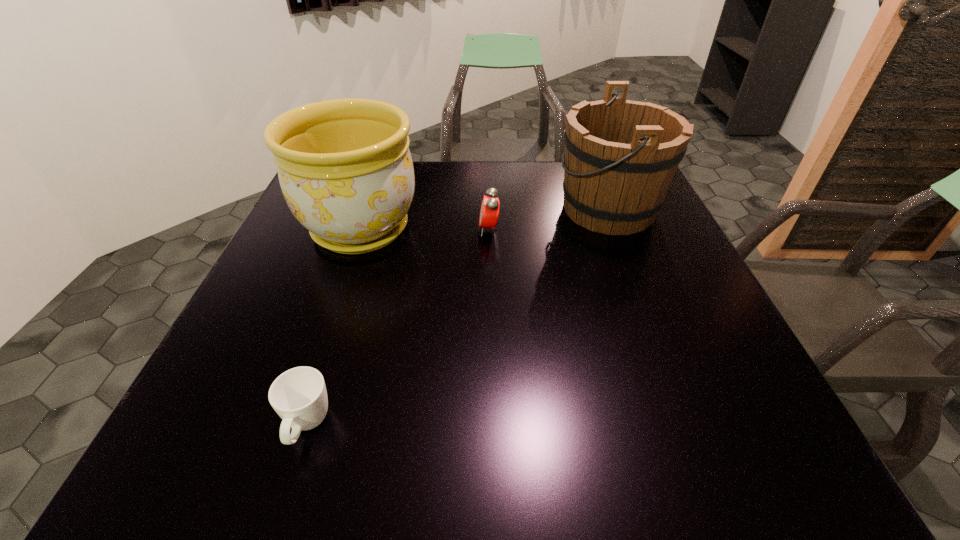
You are a GUI agent. You are given a task and a screenshot of the screen. Output one action in this format:
    pyautogui.click(x=<x>, y=<y>)
    Task: Click on the vacant space at the far edge
    This screenshot has width=960, height=540.
    Given the screenshot: What is the action you would take?
    pyautogui.click(x=455, y=195)

The height and width of the screenshot is (540, 960). In order to click on blank area at the near edge in this screenshot , I will do `click(672, 430)`.

The height and width of the screenshot is (540, 960). In the image, there is a desktop. Identify the location of free space at the left edge. (316, 276).

This screenshot has height=540, width=960. In order to click on free space at the right edge of the desktop in this screenshot , I will do `click(645, 251)`.

Identify the location of free space at the near right corner. This screenshot has width=960, height=540. (775, 442).

Locate an element on the screen. This screenshot has height=540, width=960. free space between the alarm clock and the cup is located at coordinates (397, 328).

You are a GUI agent. You are given a task and a screenshot of the screen. Output one action in this format:
    pyautogui.click(x=<x>, y=<y>)
    Task: Click on the empty location between the cup and the alarm clock
    This screenshot has width=960, height=540.
    Given the screenshot: What is the action you would take?
    pyautogui.click(x=397, y=328)

The width and height of the screenshot is (960, 540). In order to click on empty location between the nearest object and the flowerpot in this screenshot , I will do `click(334, 328)`.

The height and width of the screenshot is (540, 960). What are the coordinates of `free space between the nearest object and the flowerpot` in the screenshot? It's located at (334, 328).

I want to click on vacant area that lies between the flowerpot and the shortest object, so click(x=334, y=328).